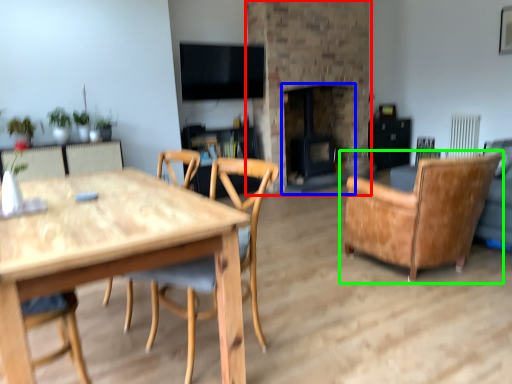
Question: Which object is positioned closest to fireplace (highlighted by a red box)? Select from fireplace (highlighted by a blue box) and chair (highlighted by a green box).

Choices:
 (A) fireplace
 (B) chair

Answer: (A)